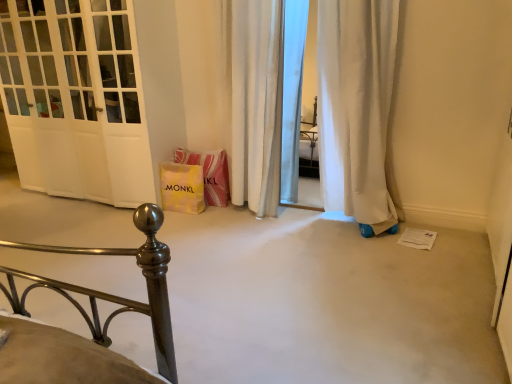
Describe the element at coordinates (209, 173) in the screenshot. I see `yellow paper bag at lower center` at that location.

Describe the element at coordinates (182, 187) in the screenshot. This screenshot has height=384, width=512. I see `yellow paper bag at center` at that location.

You are a GUI agent. You are given a task and a screenshot of the screen. Output one action in this format:
    pyautogui.click(x=<x>, y=<y>)
    Task: Click on the yellow paper bag at lower center
    
    Given the screenshot: What is the action you would take?
    pyautogui.click(x=209, y=173)

Considering the sizes of white fabric curtain at center and white glossy door at left in the image, is white fabric curtain at center wider or thinner than white glossy door at left?

Considering their sizes, white fabric curtain at center looks slimmer than white glossy door at left.

Is white fabric curtain at center looking in the opposite direction of white glossy door at left?

No.

From a real-world perspective, is white fabric curtain at center physically located above or below white glossy door at left?

Clearly, from a real-world perspective, white fabric curtain at center is below white glossy door at left.

Is point (254, 90) farther from camera compared to point (3, 50)?

No, it is not.

Is yellow paper bag at center not close to white fabric curtain at center?

No, yellow paper bag at center is in close proximity to white fabric curtain at center.

From the image's perspective, between yellow paper bag at center and white fabric curtain at center, which one is located above?

white fabric curtain at center appears higher in the image.

Image resolution: width=512 pixels, height=384 pixels. What are the coordinates of `curtain above the yellow paper bag at center (from the image's perspective)` in the screenshot? It's located at (256, 104).

Between yellow paper bag at lower center and white fabric curtain at center, which one appears on the right side from the viewer's perspective?

white fabric curtain at center is more to the right.

Is yellow paper bag at lower center closer to the viewer compared to white fabric curtain at center?

That is False.

Who is shorter, yellow paper bag at lower center or white fabric curtain at center?

yellow paper bag at lower center.

Looking at this image, from a real-world perspective, between yellow paper bag at lower center and white fabric curtain at center, who is vertically lower?

In real-world perspective, yellow paper bag at lower center is lower.

Considering the sizes of objects white fabric curtain at center and yellow paper bag at lower center in the image provided, who is smaller, white fabric curtain at center or yellow paper bag at lower center?

yellow paper bag at lower center.

Is white fabric curtain at center with yellow paper bag at lower center?

No, white fabric curtain at center is not in contact with yellow paper bag at lower center.

Is point (237, 152) behind point (194, 151)?

No, (237, 152) is closer to viewer.

Is white fabric curtain at center positioned beyond the bounds of yellow paper bag at lower center?

white fabric curtain at center lies outside yellow paper bag at lower center's area.

Which object is positioned more to the right, yellow paper bag at lower center or yellow paper bag at center?

From the viewer's perspective, yellow paper bag at lower center appears more on the right side.

Considering the relative sizes of yellow paper bag at lower center and yellow paper bag at center in the image provided, is yellow paper bag at lower center thinner than yellow paper bag at center?

Incorrect, the width of yellow paper bag at lower center is not less than that of yellow paper bag at center.

From a real-world perspective, is yellow paper bag at lower center under yellow paper bag at center?

No.

From the picture: Relative to white glossy door at left, is yellow paper bag at center in front or behind?

In the image, yellow paper bag at center appears behind white glossy door at left.

Is yellow paper bag at center placed right next to white glossy door at left?

No.

In terms of width, does yellow paper bag at center look wider or thinner when compared to white glossy door at left?

Clearly, yellow paper bag at center has less width compared to white glossy door at left.

How far apart are yellow paper bag at center and white glossy door at left?

yellow paper bag at center is 29.30 inches away from white glossy door at left.

Which is correct: yellow paper bag at center is inside yellow paper bag at lower center, or outside of it?

yellow paper bag at center is not inside yellow paper bag at lower center, it's outside.

Based on the photo, measure the distance from yellow paper bag at center to yellow paper bag at lower center.

yellow paper bag at center and yellow paper bag at lower center are 6.03 inches apart from each other.

From the image's perspective, which is above, yellow paper bag at center or yellow paper bag at lower center?

yellow paper bag at lower center, from the image's perspective.

Which object is positioned more to the left, yellow paper bag at center or yellow paper bag at lower center?

yellow paper bag at center is more to the left.

Find the location of `curtain below the white glossy door at left (from the image's perspective)`. curtain below the white glossy door at left (from the image's perspective) is located at coordinates (256, 104).

You are a GUI agent. You are given a task and a screenshot of the screen. Output one action in this format:
    pyautogui.click(x=<x>, y=<y>)
    Task: Click on the gift bag to the left of white fabric curtain at center
    This screenshot has width=512, height=384.
    Given the screenshot: What is the action you would take?
    pyautogui.click(x=182, y=187)

Considering their positions, is yellow paper bag at center positioned further to white fabric curtain at center than white glossy door at left?

Based on the image, white glossy door at left appears to be further to white fabric curtain at center.

Considering their positions, is yellow paper bag at center positioned closer to white fabric curtain at center than yellow paper bag at lower center?

yellow paper bag at lower center lies closer to white fabric curtain at center than the other object.

Which object lies nearer to the anchor point yellow paper bag at lower center, white fabric curtain at center or yellow paper bag at center?

Among the two, yellow paper bag at center is located nearer to yellow paper bag at lower center.

Which object lies nearer to the anchor point yellow paper bag at lower center, white glossy door at left or yellow paper bag at center?

yellow paper bag at center is positioned closer to the anchor yellow paper bag at lower center.

From the image, which object appears to be nearer to white glossy door at left, white fabric curtain at center or yellow paper bag at center?

The object closer to white glossy door at left is yellow paper bag at center.

Estimate the real-world distances between objects in this image. Which object is further from yellow paper bag at lower center, yellow paper bag at center or white glossy door at left?

white glossy door at left.

Looking at the image, which one is located closer to yellow paper bag at center, white fabric curtain at center or white glossy door at left?

white fabric curtain at center is positioned closer to the anchor yellow paper bag at center.

Based on their spatial positions, is white fabric curtain at center or yellow paper bag at lower center closer to yellow paper bag at center?

yellow paper bag at lower center is positioned closer to the anchor yellow paper bag at center.

Where is `gift bag located between white glossy door at left and yellow paper bag at lower center in the left-right direction`? The width and height of the screenshot is (512, 384). gift bag located between white glossy door at left and yellow paper bag at lower center in the left-right direction is located at coordinates (182, 187).

What are the coordinates of `gift bag between white glossy door at left and white fabric curtain at center from left to right` in the screenshot? It's located at (182, 187).

Where is `material between white glossy door at left and white fabric curtain at center in the horizontal direction`? The height and width of the screenshot is (384, 512). material between white glossy door at left and white fabric curtain at center in the horizontal direction is located at coordinates (209, 173).

Locate an element on the screen. This screenshot has width=512, height=384. gift bag located between white fabric curtain at center and yellow paper bag at lower center in the depth direction is located at coordinates (182, 187).